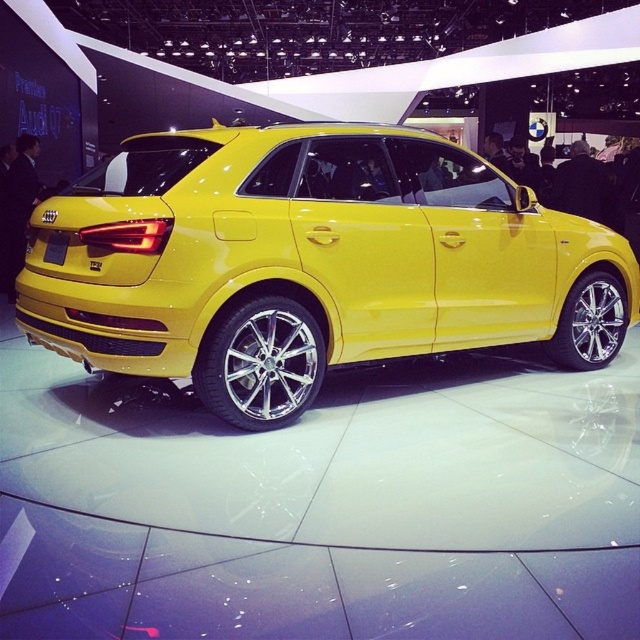
Between yellow metallic car at center and yellow matte license plate at rear, which one is positioned lower?

yellow metallic car at center is lower down.

Is the position of yellow metallic car at center less distant than that of yellow matte license plate at rear?

That is True.

I want to click on yellow metallic car at center, so click(x=310, y=262).

Where is `yellow metallic car at center`? This screenshot has height=640, width=640. yellow metallic car at center is located at coordinates (310, 262).